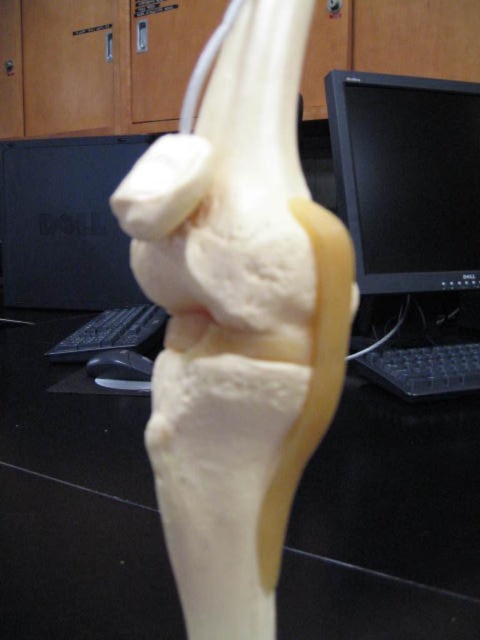
You are setting up a workstation and need to place the black plastic keyboard at center and the black glossy monitor at upper right. According to the image, which object is positioned to the left of the other?

The black plastic keyboard at center is to the left of the black glossy monitor at upper right.

You are organizing a classroom and need to place the black plastic keyboard at center and the black glossy monitor at upper right on a desk. Given their sizes, which object should you place first to ensure they both fit properly?

The black plastic keyboard at center has a smaller size compared to the black glossy monitor at upper right. You should place the black glossy monitor at upper right first since it is larger and requires more space, ensuring there is enough room left for the smaller keyboard.

You are a student sitting in front of the model knee joint and need to reach for either the black plastic keyboard at center or the black glossy monitor at upper right. Which object is positioned lower relative to the other?

The black plastic keyboard at center is located below the black glossy monitor at upper right, so it is positioned lower.